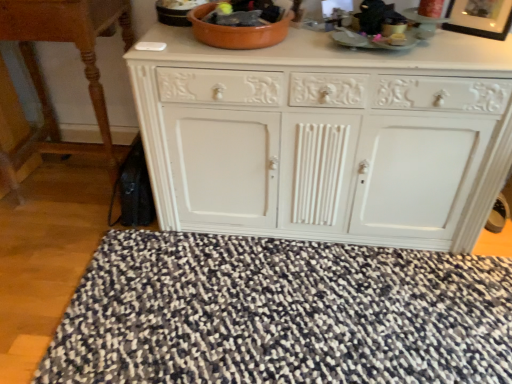
Locate an element on the screen. vacant area that is in front of wooden table at left is located at coordinates (67, 255).